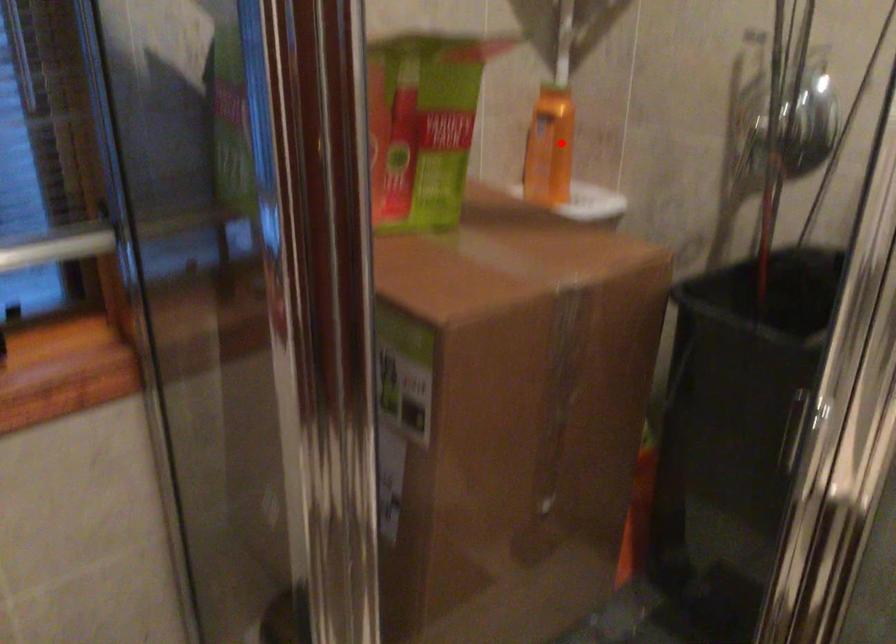
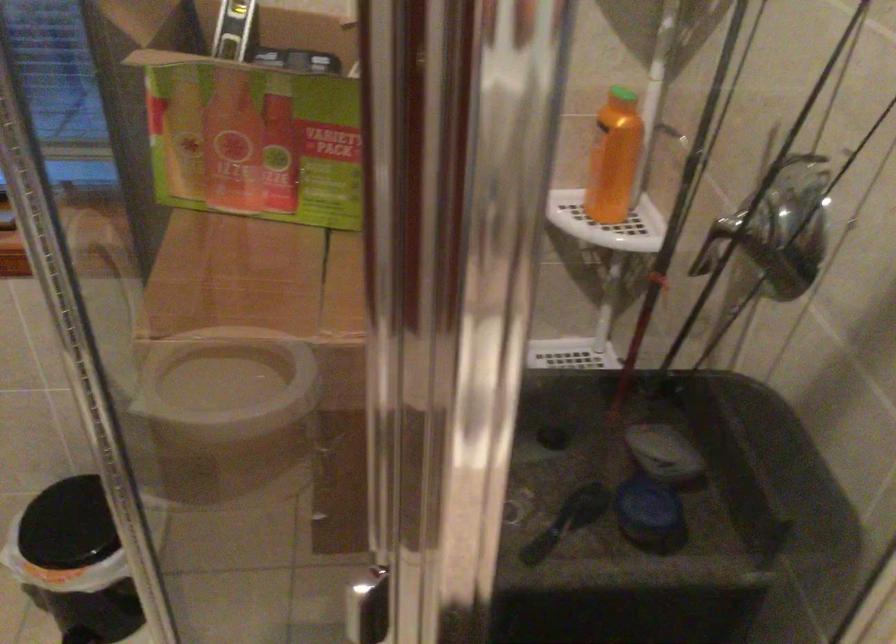
Question: I am providing you with two images of the same scene from different viewpoints. Given a red point in image1, look at the same physical point in image2. Is it:

Choices:
 (A) Closer to the viewpoint
 (B) Farther from the viewpoint

Answer: (A)